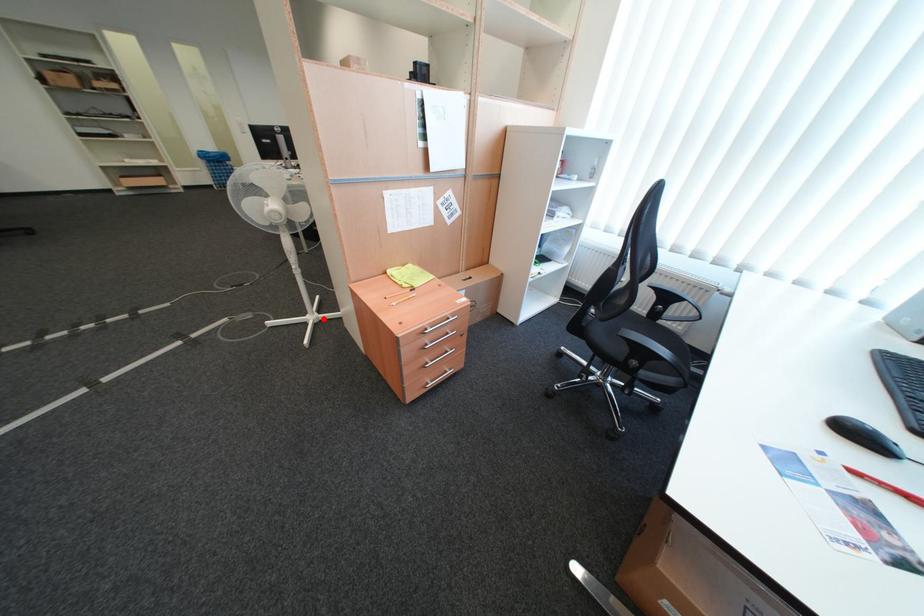
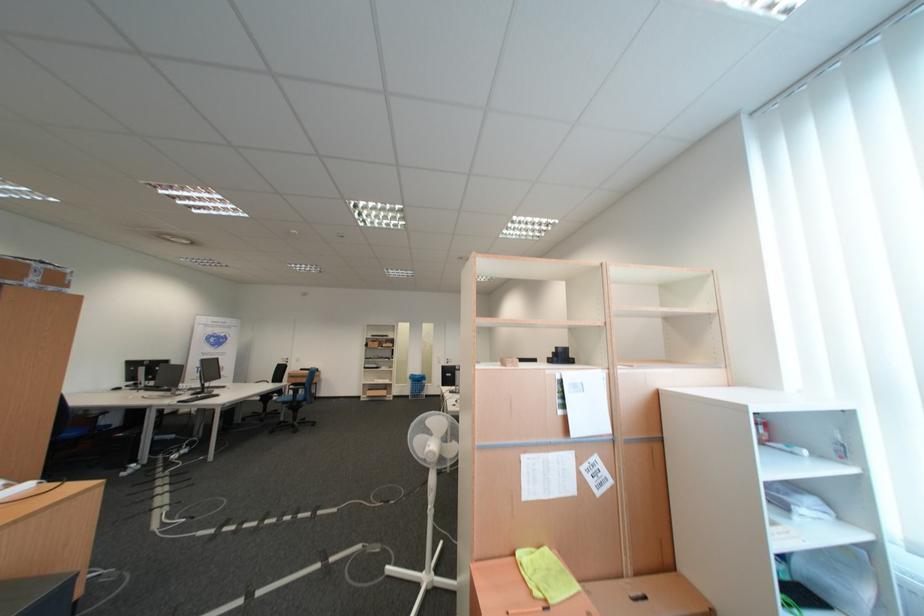
Find the pixel in the second image that matches the highlighted location in the first image.

(439, 578)